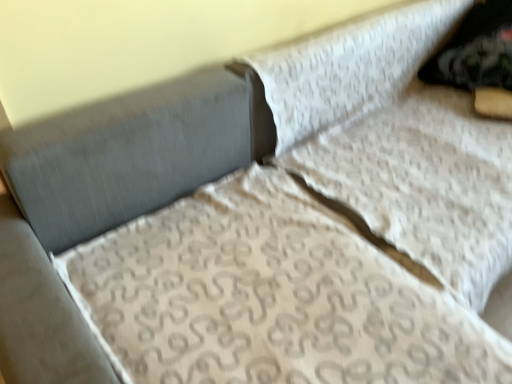
Measure the distance between point (463, 137) and camera.

They are 1.49 meters apart.

This screenshot has width=512, height=384. What do you see at coordinates (424, 184) in the screenshot?
I see `beige textured fabric at upper right` at bounding box center [424, 184].

What are the coordinates of `beige textured fabric at upper right` in the screenshot? It's located at (424, 184).

The height and width of the screenshot is (384, 512). Find the location of `beige textured fabric at upper right`. beige textured fabric at upper right is located at coordinates (424, 184).